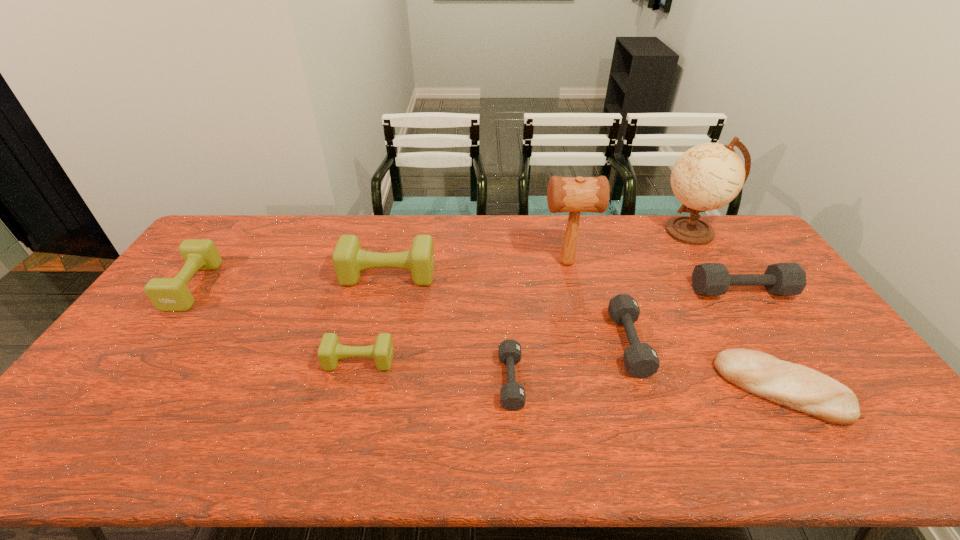
The image size is (960, 540). What are the coordinates of `object that is positioned at the near edge` in the screenshot? It's located at (798, 387).

Where is `object present at the left edge`? Image resolution: width=960 pixels, height=540 pixels. object present at the left edge is located at coordinates (167, 294).

This screenshot has width=960, height=540. I want to click on globe present at the right edge, so click(x=708, y=176).

Where is `dumbbell positioned at the right edge`? The height and width of the screenshot is (540, 960). dumbbell positioned at the right edge is located at coordinates (708, 279).

The image size is (960, 540). What are the coordinates of `bread present at the right edge` in the screenshot? It's located at (798, 387).

I want to click on object that is positioned at the far right corner, so click(x=708, y=176).

Find the location of a particular element. object present at the near right corner is located at coordinates (798, 387).

Image resolution: width=960 pixels, height=540 pixels. In order to click on vacant space at the far edge of the desktop in this screenshot , I will do `click(442, 252)`.

Locate an element on the screen. Image resolution: width=960 pixels, height=540 pixels. free space at the near edge of the desktop is located at coordinates point(152,446).

Find the location of a particular element. This screenshot has height=540, width=960. free space at the left edge of the desktop is located at coordinates (210, 292).